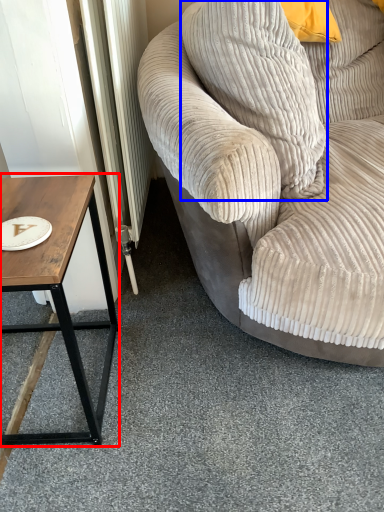
Question: Among these objects, which one is nearest to the camera, coffee table (highlighted by a red box) or pillow (highlighted by a blue box)?

Choices:
 (A) coffee table
 (B) pillow

Answer: (A)